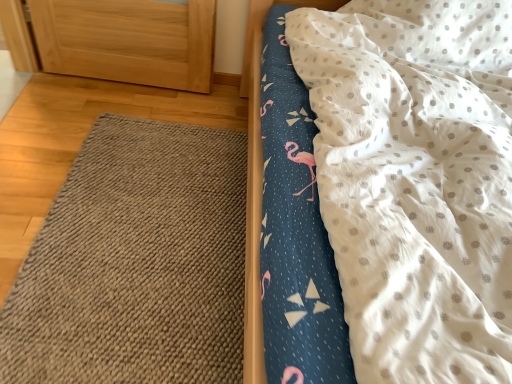
Question: Is white dotted fabric at upper right far from brown woven mat at lower left?

Choices:
 (A) no
 (B) yes

Answer: (A)

Question: Is white dotted fabric at upper right in front of brown woven mat at lower left?

Choices:
 (A) no
 (B) yes

Answer: (B)

Question: Is white dotted fabric at upper right at the left side of brown woven mat at lower left?

Choices:
 (A) no
 (B) yes

Answer: (A)

Question: Is white dotted fabric at upper right looking in the opposite direction of brown woven mat at lower left?

Choices:
 (A) no
 (B) yes

Answer: (A)

Question: Does white dotted fabric at upper right have a greater height compared to brown woven mat at lower left?

Choices:
 (A) yes
 (B) no

Answer: (A)

Question: From a real-world perspective, is white dotted fabric at upper right located beneath brown woven mat at lower left?

Choices:
 (A) yes
 (B) no

Answer: (B)

Question: Considering the relative sizes of brown woven mat at lower left and white dotted fabric at upper right in the image provided, is brown woven mat at lower left shorter than white dotted fabric at upper right?

Choices:
 (A) yes
 (B) no

Answer: (A)

Question: From a real-world perspective, is brown woven mat at lower left positioned over white dotted fabric at upper right based on gravity?

Choices:
 (A) yes
 (B) no

Answer: (B)

Question: Considering the relative sizes of brown woven mat at lower left and white dotted fabric at upper right in the image provided, is brown woven mat at lower left taller than white dotted fabric at upper right?

Choices:
 (A) no
 (B) yes

Answer: (A)

Question: Can we say brown woven mat at lower left lies outside white dotted fabric at upper right?

Choices:
 (A) yes
 (B) no

Answer: (A)

Question: Is brown woven mat at lower left far away from white dotted fabric at upper right?

Choices:
 (A) yes
 (B) no

Answer: (B)

Question: Can you confirm if brown woven mat at lower left is smaller than white dotted fabric at upper right?

Choices:
 (A) no
 (B) yes

Answer: (B)

Question: Considering the positions of brown woven mat at lower left and white dotted fabric at upper right in the image, is brown woven mat at lower left wider or thinner than white dotted fabric at upper right?

Choices:
 (A) wide
 (B) thin

Answer: (B)